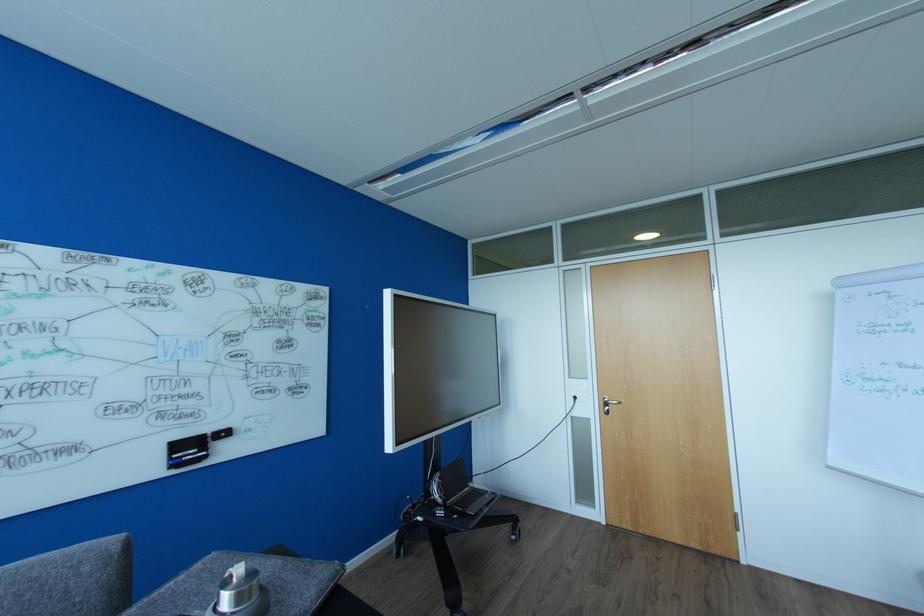
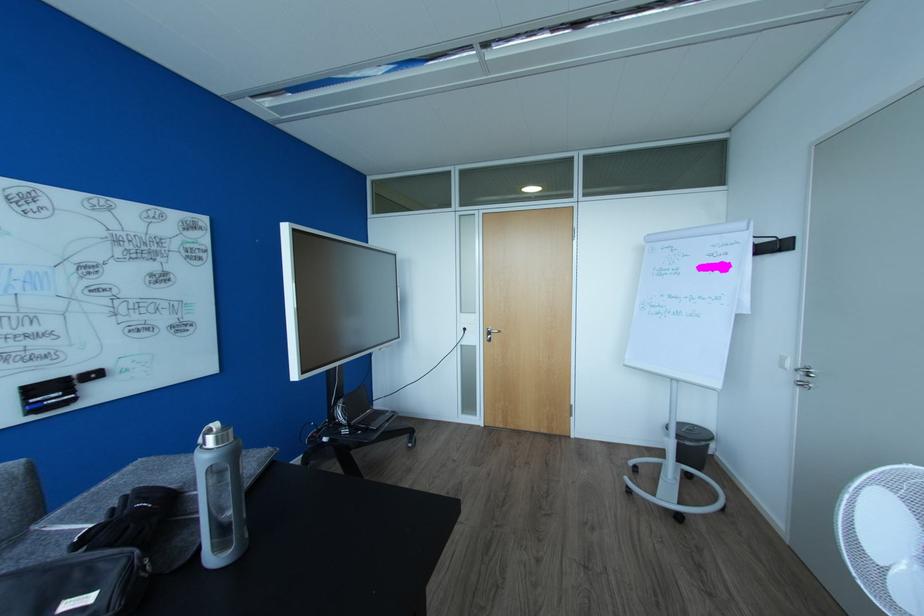
Question: The images are taken continuously from a first-person perspective. In which direction are you moving?

Choices:
 (A) Left
 (B) Right
 (C) Forward
 (D) Backward

Answer: (D)